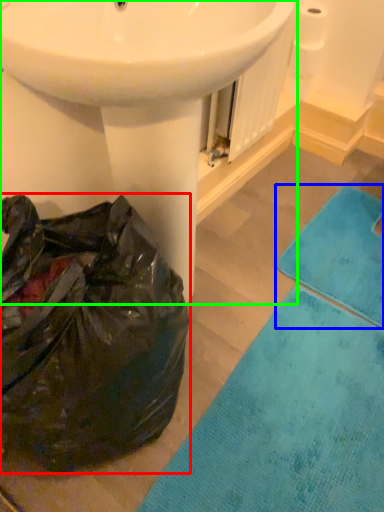
Question: Which object is the farthest from paper bag (highlighted by a red box)? Choose among these: bath towel (highlighted by a blue box) or sink (highlighted by a green box).

Choices:
 (A) bath towel
 (B) sink

Answer: (A)